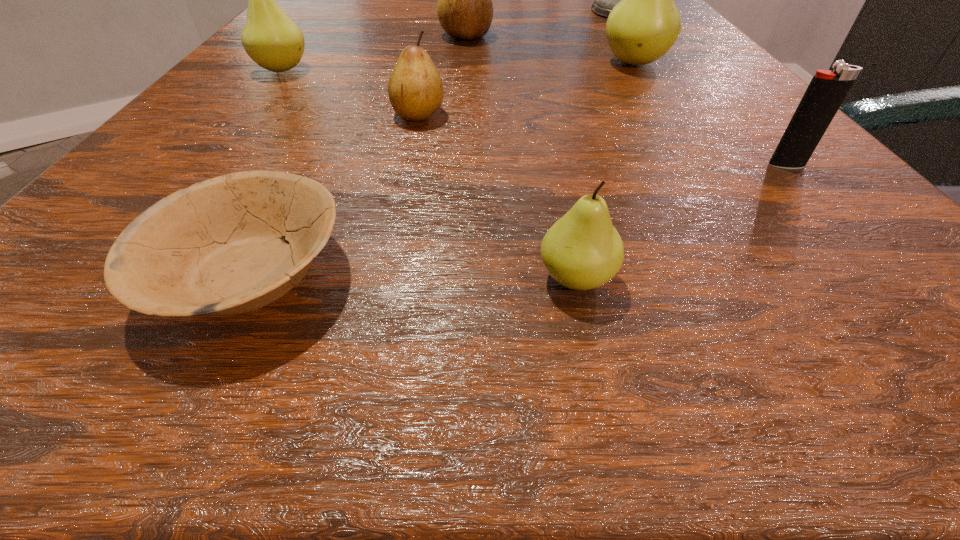
What are the coordinates of `the fifth farthest object` in the screenshot? It's located at (415, 88).

I want to click on the nearer brown pear, so click(415, 88).

Find the location of a particular element. The height and width of the screenshot is (540, 960). the second pear from right to left is located at coordinates (582, 250).

Locate an element on the screen. the smallest green pear is located at coordinates (582, 250).

Locate an element on the screen. The width and height of the screenshot is (960, 540). bowl is located at coordinates (215, 248).

Locate an element on the screen. This screenshot has height=540, width=960. free spot located 0.350m on the left of the aerosol can is located at coordinates tap(418, 11).

The width and height of the screenshot is (960, 540). I want to click on vacant point located 0.200m on the back of the rightmost pear, so click(x=604, y=15).

The width and height of the screenshot is (960, 540). In order to click on free space located 0.120m on the left of the bigger brown pear in this screenshot , I will do `click(373, 36)`.

Image resolution: width=960 pixels, height=540 pixels. In order to click on free space located on the back of the leftmost green pear in this screenshot , I will do `click(323, 19)`.

Find the location of a particular element. vacant region located 0.260m on the back of the sixth farthest object is located at coordinates (705, 73).